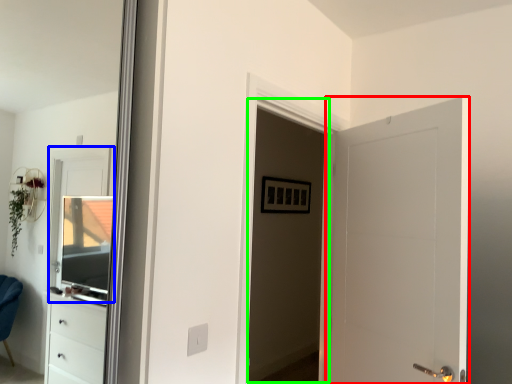
Question: Considering the real-world distances, which object is closest to door (highlighted by a red box)? window (highlighted by a blue box) or screen door (highlighted by a green box).

Choices:
 (A) window
 (B) screen door

Answer: (B)